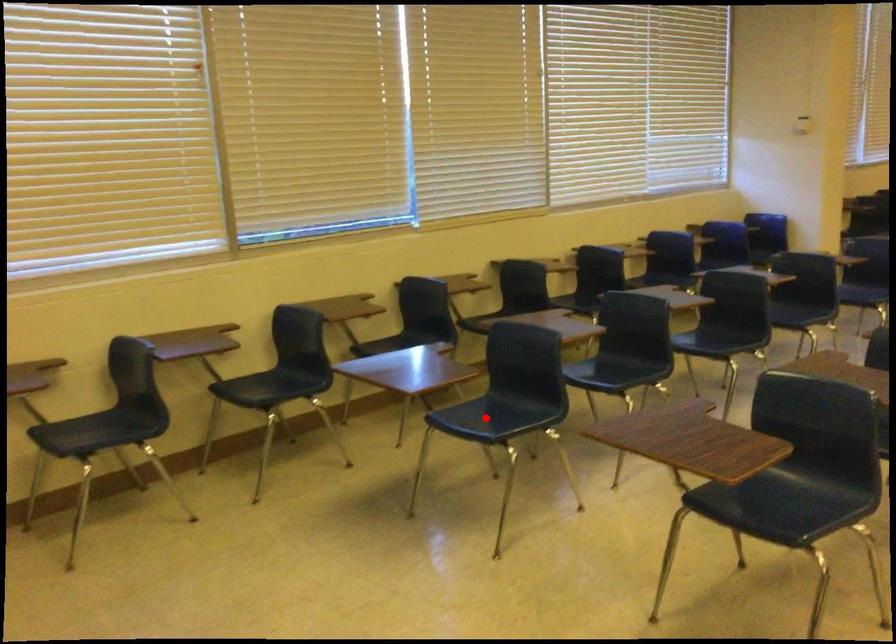
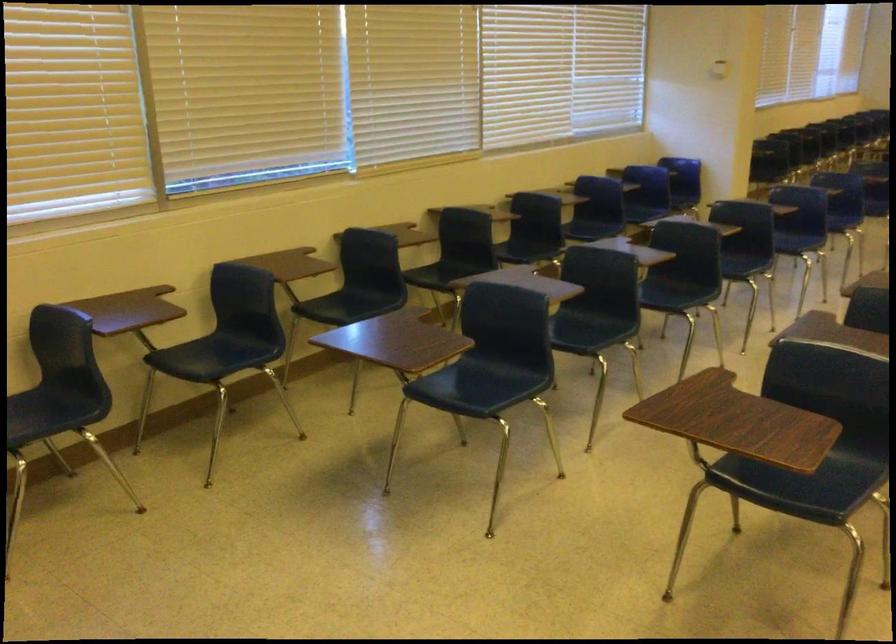
Locate, in the second image, the point that corresponds to the highlighted location in the first image.

(467, 386)